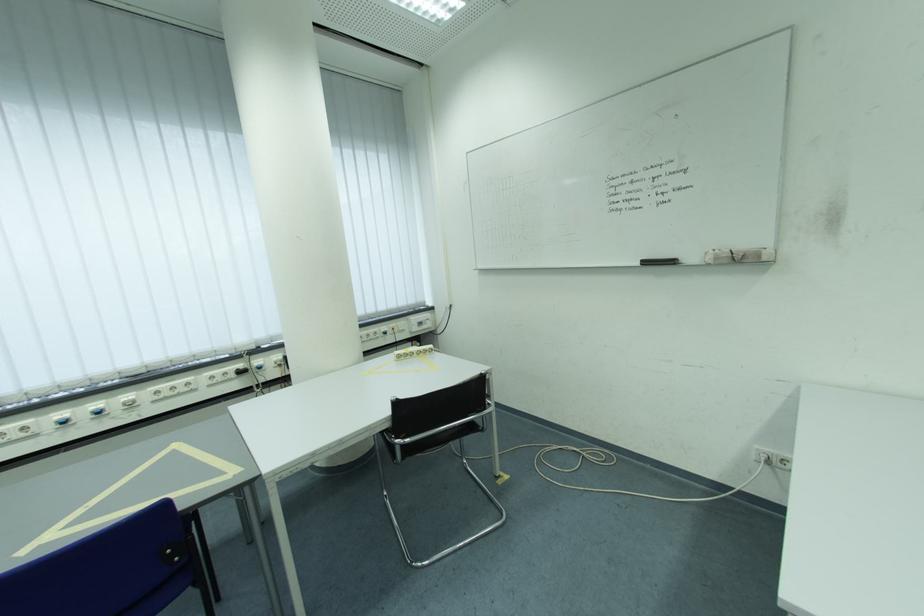
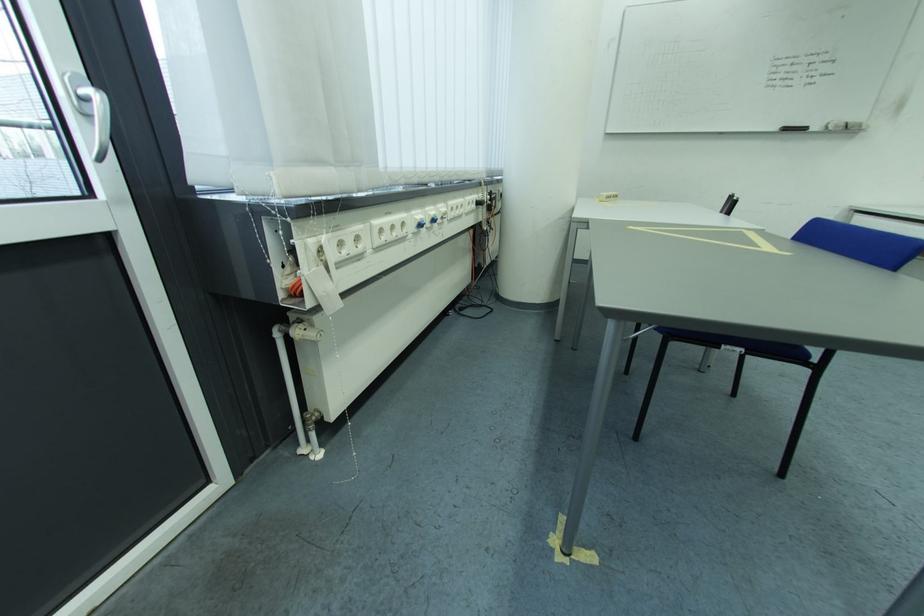
Where in the second image is the point corresponding to point 181,383 from the first image?

(465, 200)